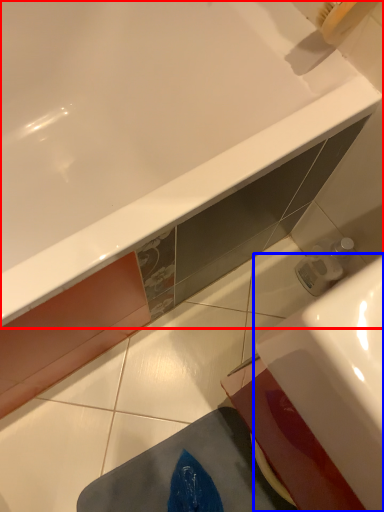
Question: Which of the following is the closest to the observer, bathtub (highlighted by a red box) or sink (highlighted by a blue box)?

Choices:
 (A) bathtub
 (B) sink

Answer: (B)